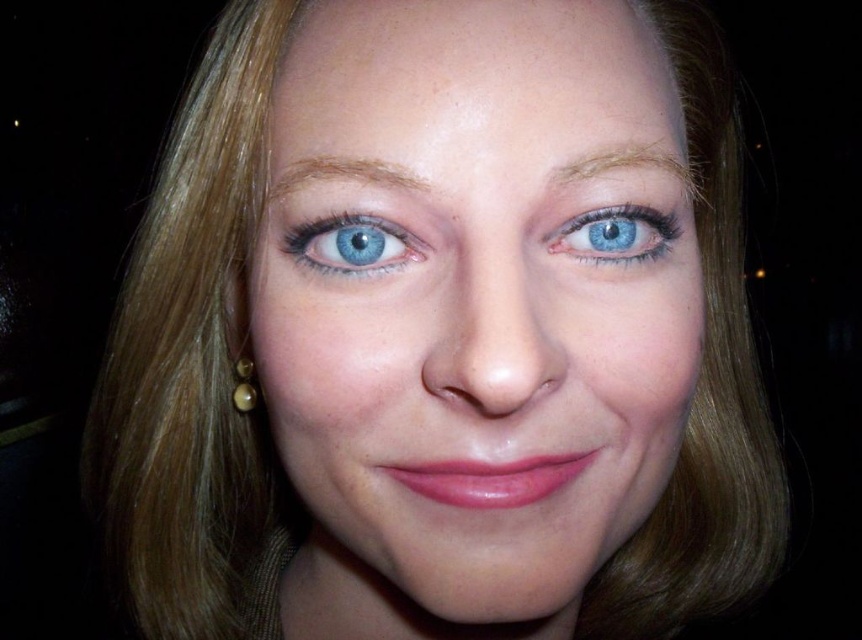
You are an artist analyzing the composition of this portrait. Based on the placement of the blue glossy eye at center and the light brown hair at upper center, which object is positioned higher in the image?

The light brown hair at upper center is positioned higher than the blue glossy eye at center.

Looking at this image, you are a photographer adjusting the lighting for a closeup portrait. You notice the blue matte eye at upper center and the gold pearl earring at lower left in the frame. Considering their sizes, which object might require more focused lighting to ensure visibility?

The blue matte eye at upper center is smaller than the gold pearl earring at lower left, so it might require more focused lighting to ensure visibility.

You are a photographer adjusting the lighting for a portrait. You notice the blue glossy eye at center and the light brown hair at upper center. Which object is located to the left of the other?

The blue glossy eye at center is positioned on the left side of light brown hair at upper center.